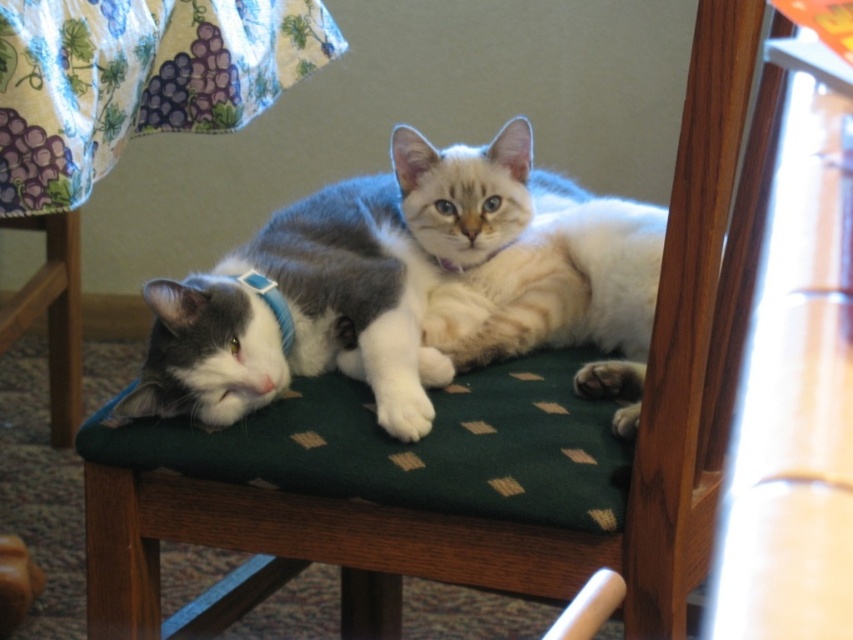
At what (x,y) coordinates should I click in order to perform the action: click on gray matte fur cat at center. Please return your answer as a coordinate pair (x, y). Looking at the image, I should click on (299, 316).

Who is taller, gray matte fur cat at center or blue fabric neckband at left?

gray matte fur cat at center is taller.

Image resolution: width=853 pixels, height=640 pixels. I want to click on gray matte fur cat at center, so click(x=299, y=316).

Locate an element on the screen. gray matte fur cat at center is located at coordinates (299, 316).

Which of these two, gray matte fur cat at center or light brown fur at center, stands shorter?

With less height is gray matte fur cat at center.

Looking at this image, does gray matte fur cat at center have a greater width compared to light brown fur at center?

Yes.

Identify the location of gray matte fur cat at center. The width and height of the screenshot is (853, 640). (299, 316).

In the scene shown: Between light brown fur at center and blue fabric neckband at left, which one appears on the left side from the viewer's perspective?

From the viewer's perspective, blue fabric neckband at left appears more on the left side.

Can you confirm if light brown fur at center is taller than blue fabric neckband at left?

Yes.

Between point (570, 273) and point (287, 305), which one is positioned behind?

Point (570, 273)

What are the coordinates of `light brown fur at center` in the screenshot? It's located at (531, 260).